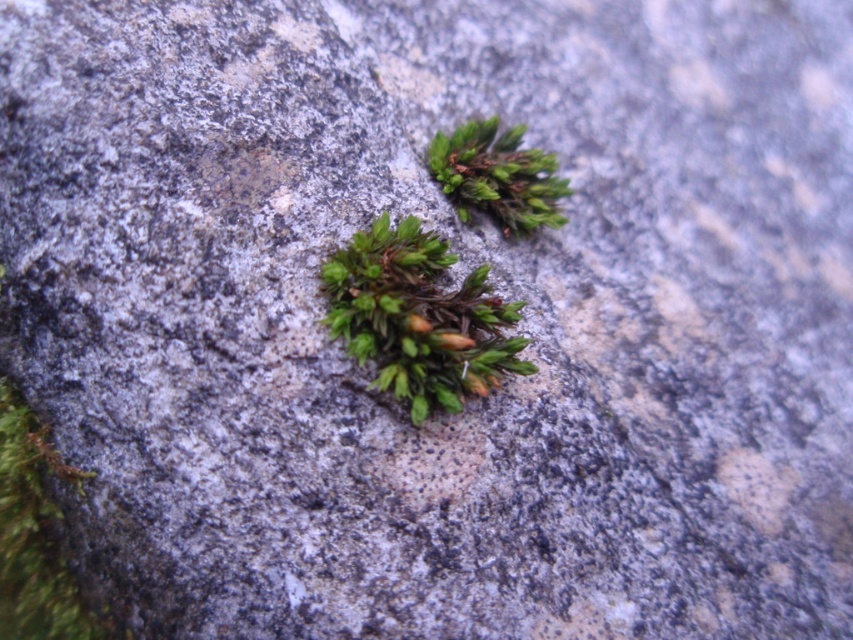
Question: Which object appears farthest from the camera in this image?

Choices:
 (A) green fuzzy moss at center
 (B) green fuzzy moss at upper center

Answer: (B)

Question: Does green fuzzy moss at center appear on the left side of green fuzzy moss at upper center?

Choices:
 (A) no
 (B) yes

Answer: (B)

Question: Among these points, which one is farthest from the camera?

Choices:
 (A) tap(466, 371)
 (B) tap(486, 156)

Answer: (B)

Question: Observing the image, what is the correct spatial positioning of green fuzzy moss at center in reference to green fuzzy moss at upper center?

Choices:
 (A) above
 (B) below

Answer: (B)

Question: Can you confirm if green fuzzy moss at center is wider than green fuzzy moss at upper center?

Choices:
 (A) no
 (B) yes

Answer: (B)